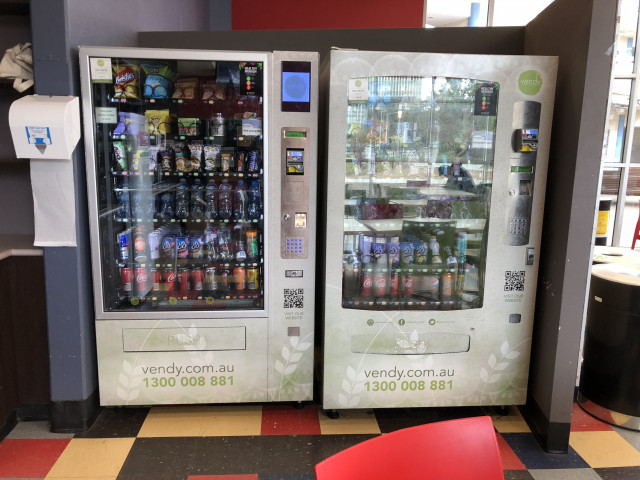
Find the location of a particular element. The height and width of the screenshot is (480, 640). window is located at coordinates (634, 192), (600, 230).